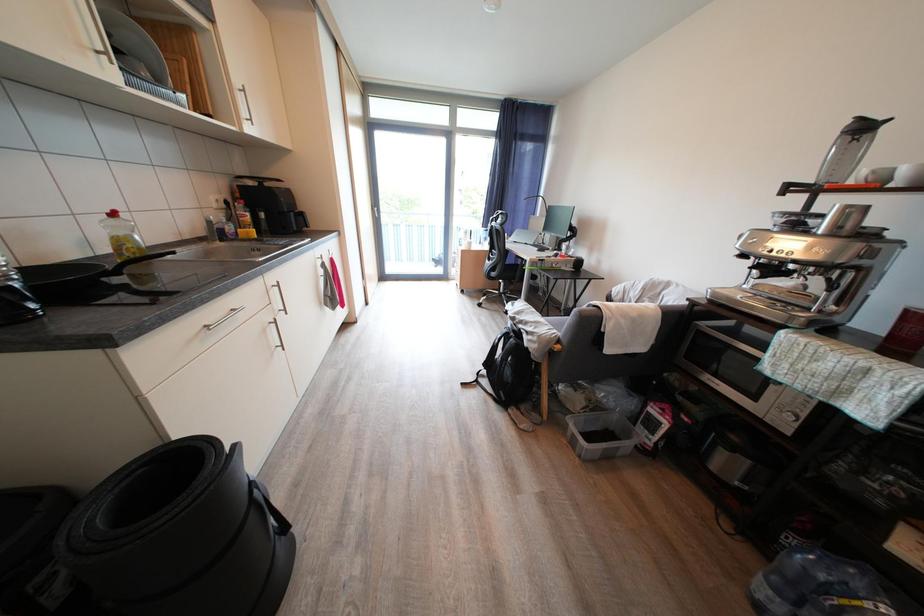
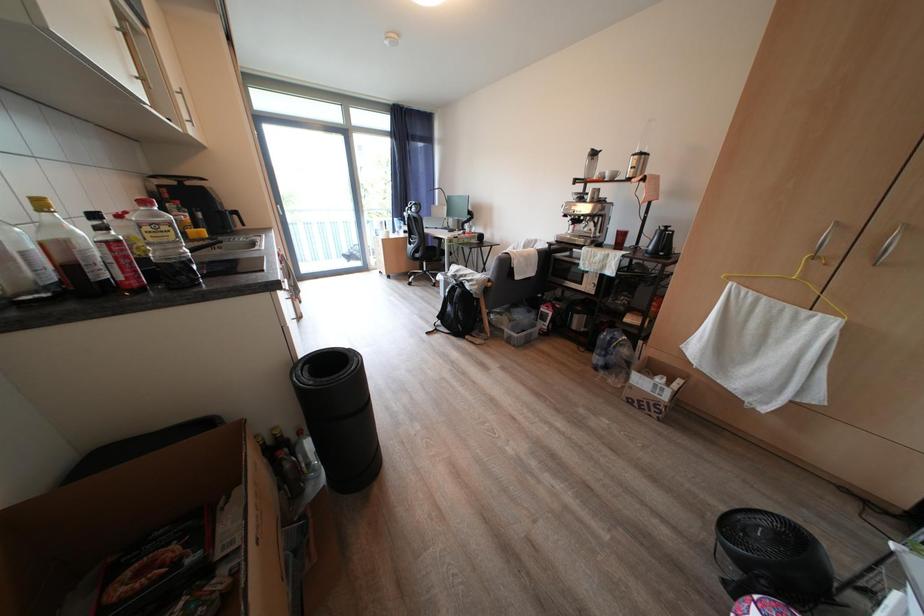
Question: The camera is either moving clockwise (left) or counter-clockwise (right) around the object. The first image is from the beginning of the video and the second image is from the end. Is the camera moving left or right when shooting the video?

Choices:
 (A) Left
 (B) Right

Answer: (A)